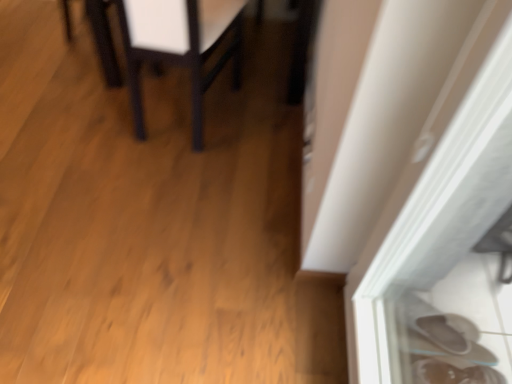
Where is `vacant area that is in front of matte black table at upper left`? vacant area that is in front of matte black table at upper left is located at coordinates (160, 180).